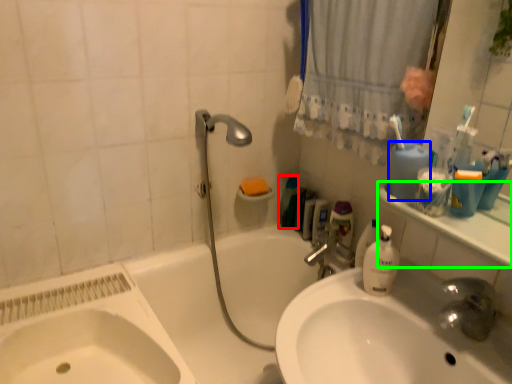
Question: Which object is positioned closest to cleaning product (highlighted by a red box)? Select from mouthwash (highlighted by a blue box) and counter top (highlighted by a green box).

Choices:
 (A) mouthwash
 (B) counter top

Answer: (A)